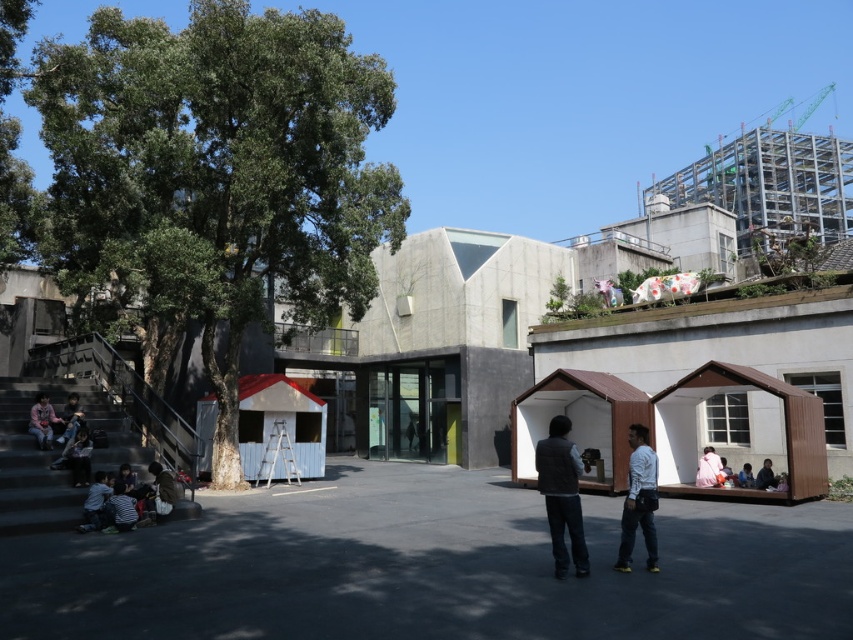
Can you confirm if striped fabric shirt at lower left is taller than light brown leather jacket at lower left?

No.

Between striped fabric shirt at lower left and light brown leather jacket at lower left, which one is positioned higher?

light brown leather jacket at lower left is higher up.

Image resolution: width=853 pixels, height=640 pixels. Find the location of `striped fabric shirt at lower left`. striped fabric shirt at lower left is located at coordinates (96, 502).

Who is higher up, striped fabric shirt at lower left or light blue shirt at lower right?

striped fabric shirt at lower left

From the picture: Who is positioned more to the left, striped fabric shirt at lower left or light blue shirt at lower right?

From the viewer's perspective, striped fabric shirt at lower left appears more on the left side.

Who is more forward, (105,484) or (750,474)?

Point (105,484)

In order to click on striped fabric shirt at lower left in this screenshot , I will do `click(96, 502)`.

From the picture: Is green leafy tree at left below wooden cabin at center?

Actually, green leafy tree at left is above wooden cabin at center.

Is point (235, 124) farther from viewer compared to point (613, 456)?

No, (235, 124) is in front of (613, 456).

Find the location of a particular element. green leafy tree at left is located at coordinates (216, 179).